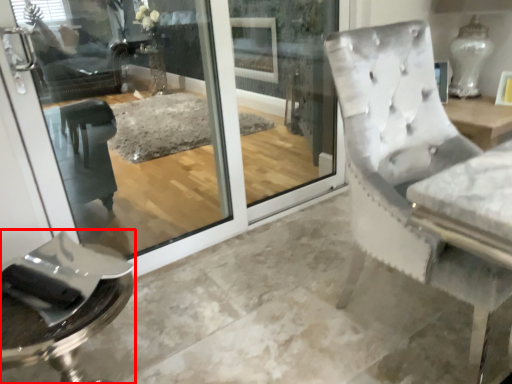
Question: Where is furniture (annotated by the red box) located in relation to screen door in the image?

Choices:
 (A) left
 (B) right

Answer: (A)